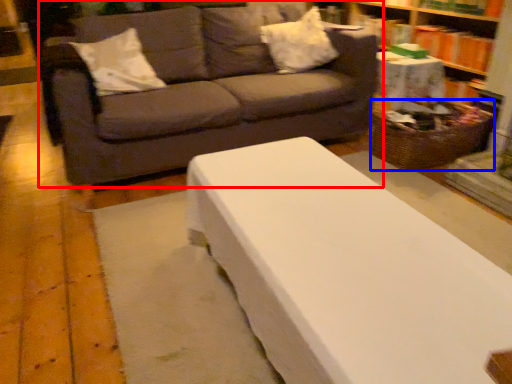
Question: Which object appears farthest to the camera in this image, studio couch (highlighted by a red box) or basket (highlighted by a blue box)?

Choices:
 (A) studio couch
 (B) basket

Answer: (B)